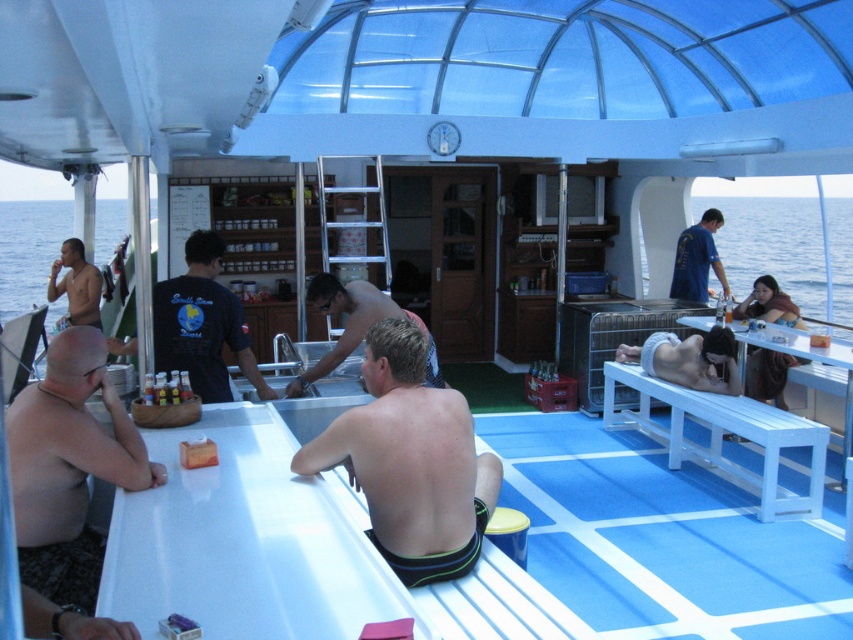
Where is the dark blue shirt at center located in the image?

The dark blue shirt at center is located at point coordinates of (202,323).

You are standing on the deck of the boat and want to take a photo of the point at coordinates point (x=775, y=243). The camera you are using has a maximum focus range of 25 meters. Will the camera be able to focus on the point?

The distance of point (x=775, y=243) from the camera is 24.60 meters, which is within the camera maximum focus range of 25 meters. Therefore, the camera will be able to focus on the point.

You are standing inside the boat and looking out towards the blue water at upper right and the blue water at left. Which of these two areas of water is closer to you?

The blue water at upper right is closer to you because it is further to the viewer than the blue water at left.